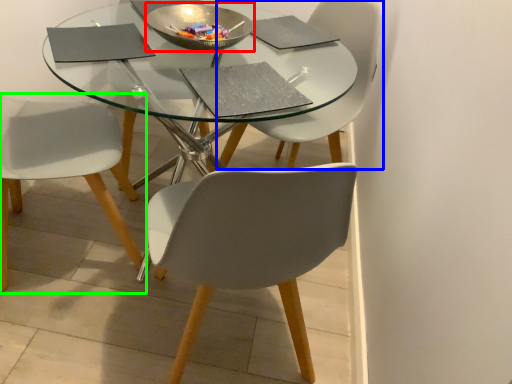
Question: Which is farther away from bowl (highlighted by a red box)? chair (highlighted by a blue box) or chair (highlighted by a green box)?

Choices:
 (A) chair
 (B) chair

Answer: (B)